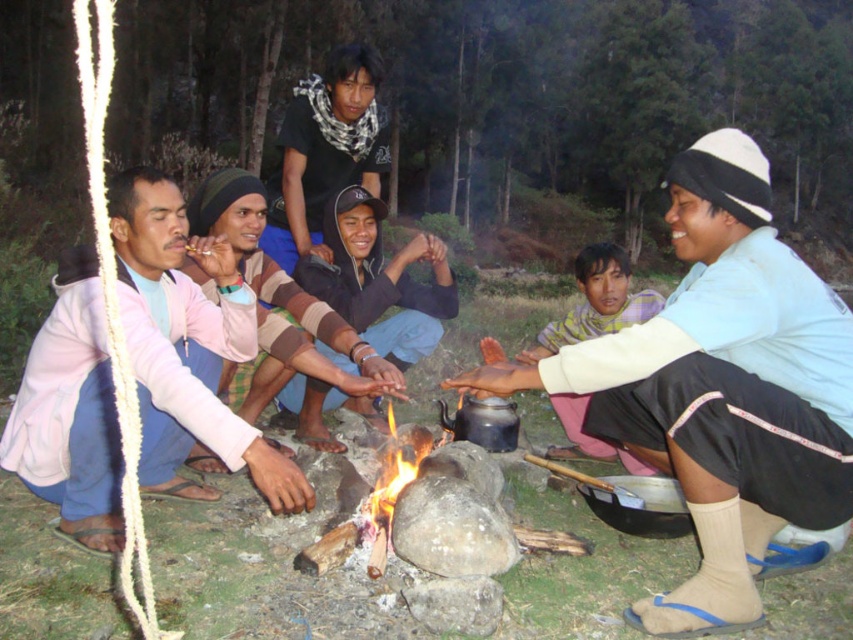
You are planning to borrow a jacket from either the brown striped sweater at center or the matte black jacket at center. Which one is larger in size?

The brown striped sweater at center is bigger than the matte black jacket at center, so you should choose the brown striped sweater at center for a larger size.

You are standing at the edge of the campfire area and want to hand a marshmallow to the person wearing the brown striped sweater at center. If your arm can reach 1.8 meters, will you be able to reach them without moving closer?

The brown striped sweater at center and viewer are 2.54 meters apart from each other. Since your arm can only reach 1.8 meters, you will not be able to reach them without moving closer.

You are standing in the forest and see the brown striped sweater at center and the matte black jacket at center. Which one is closer to you?

Answer: The brown striped sweater at center is closer to you because it is in front of the matte black jacket at center.